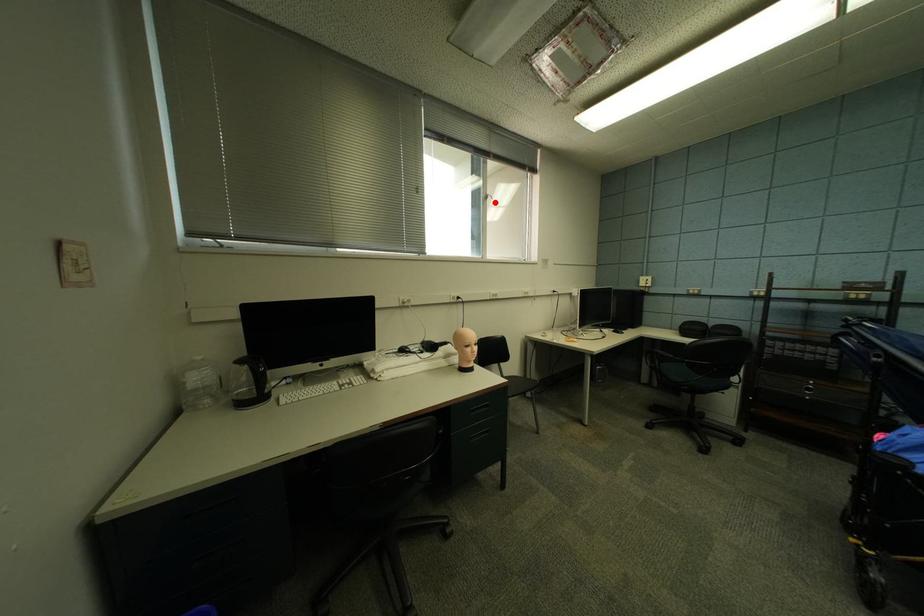
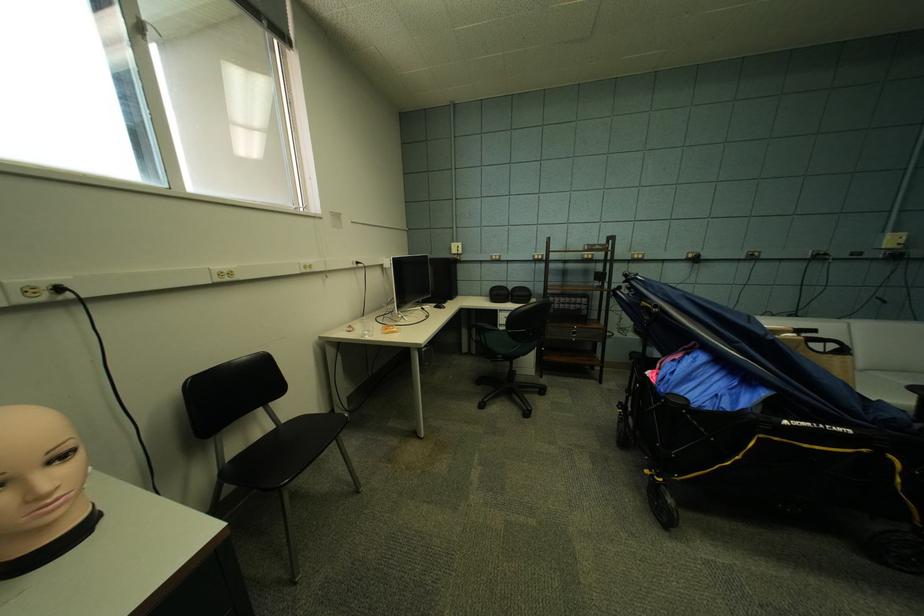
Question: I am providing you with two images of the same scene from different viewpoints. In image1, a red point is highlighted. Considering the same 3D point in image2, which of the following is correct?

Choices:
 (A) It is closer
 (B) It is farther

Answer: (B)